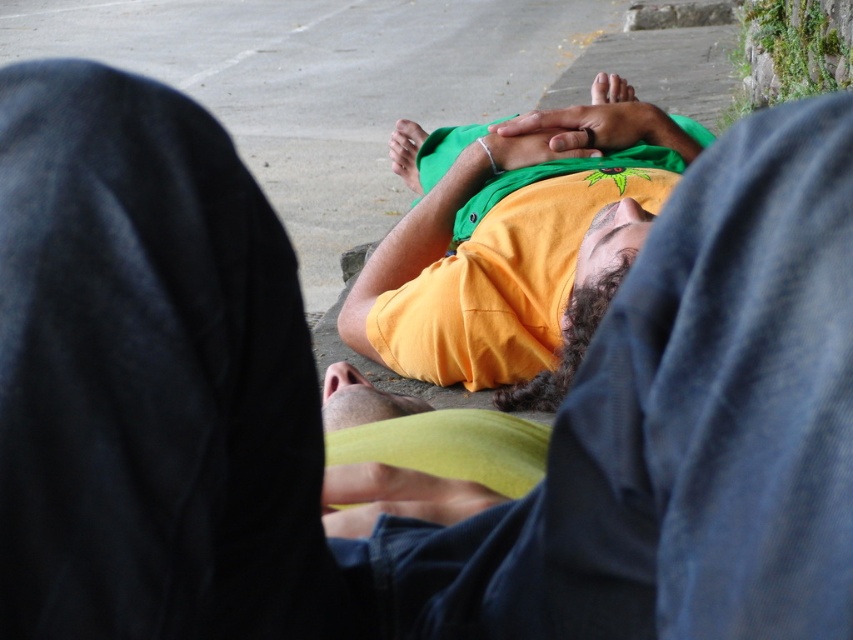
You are a photographer trying to capture a clear shot of the person lying down on the concrete surface. There are two points in the image labeled as point 1 at coordinates point (x=570, y=118) and point 2 at coordinates point (x=335, y=369). Which point is closer to the camera and might be blocking your view of the person?

Point 1 at coordinates point (x=570, y=118) is closer to the camera than point 2 at coordinates point (x=335, y=369), so it might be blocking your view of the person.